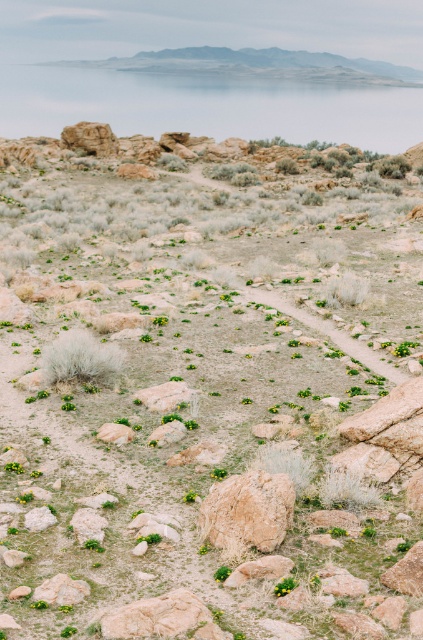
Question: Which of the following is the farthest from the observer?

Choices:
 (A) brown rough rock at center
 (B) transparent glass lake at upper center

Answer: (B)

Question: Which object appears farthest from the camera in this image?

Choices:
 (A) transparent glass lake at upper center
 (B) brown rough rock at center

Answer: (A)

Question: Does transparent glass lake at upper center have a larger size compared to brown rough rock at center?

Choices:
 (A) no
 (B) yes

Answer: (B)

Question: Is transparent glass lake at upper center above brown rough rock at center?

Choices:
 (A) no
 (B) yes

Answer: (B)

Question: Does transparent glass lake at upper center have a larger size compared to brown rough rock at center?

Choices:
 (A) yes
 (B) no

Answer: (A)